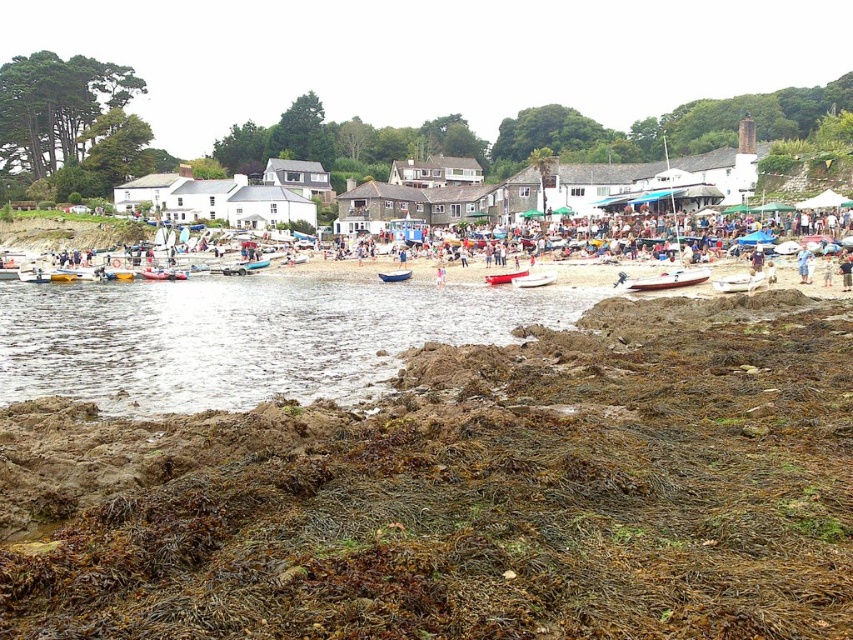
Does brown/muddy soil at lower left appear on the left side of white plastic boat at center?

Indeed, brown/muddy soil at lower left is positioned on the left side of white plastic boat at center.

Which is in front, point (799, 442) or point (544, 278)?

Point (799, 442)

Where is `brown/muddy soil at lower left`? brown/muddy soil at lower left is located at coordinates (465, 493).

Does point (756, 273) lie behind point (508, 276)?

No, (756, 273) is in front of (508, 276).

Who is more distant from viewer, (761, 284) or (509, 278)?

The point (509, 278) is more distant.

Where is `white matte boat at center`? The width and height of the screenshot is (853, 640). white matte boat at center is located at coordinates (740, 282).

Is white plastic boat at center taller than red plastic boat at center?

In fact, white plastic boat at center may be shorter than red plastic boat at center.

Can you confirm if white plastic boat at center is thinner than red plastic boat at center?

Yes.

At what (x,y) coordinates should I click in order to perform the action: click on white plastic boat at center. Please return your answer as a coordinate pair (x, y). Looking at the image, I should click on (534, 280).